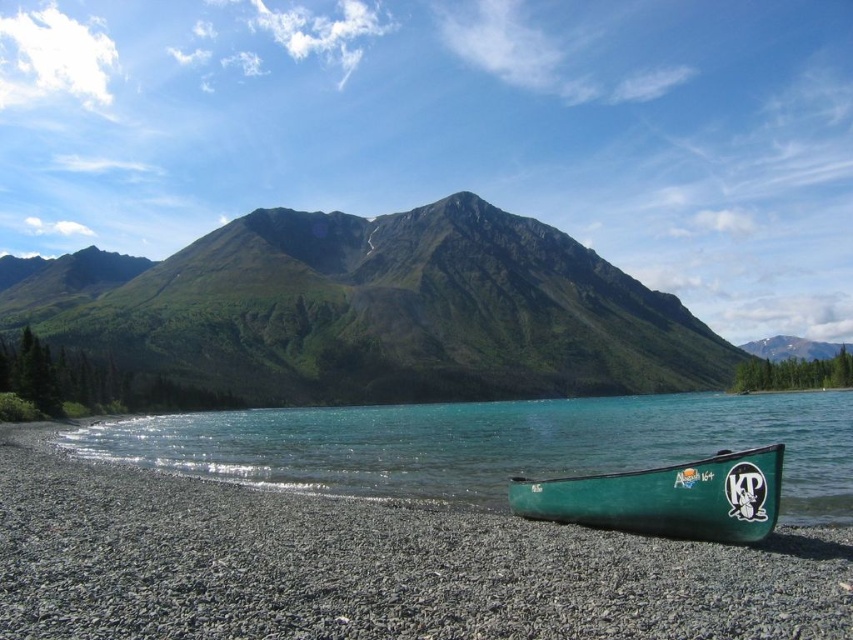
Question: Which of these objects is positioned closest to the green grassy mountain at center?

Choices:
 (A) green matte canoe at lower right
 (B) green plastic canoe at lower center
 (C) green plastic canoe at lower right

Answer: (C)

Question: Can you confirm if green plastic canoe at lower center is positioned to the left of green plastic canoe at lower right?

Choices:
 (A) no
 (B) yes

Answer: (B)

Question: Estimate the real-world distances between objects in this image. Which object is farther from the green matte canoe at lower right?

Choices:
 (A) green plastic canoe at lower center
 (B) green plastic canoe at lower right
 (C) green grassy mountain at center

Answer: (C)

Question: Which of these objects is positioned closest to the green matte canoe at lower right?

Choices:
 (A) green grassy mountain at center
 (B) green plastic canoe at lower right
 (C) green plastic canoe at lower center

Answer: (C)

Question: Where is green grassy mountain at center located in relation to green plastic canoe at lower right in the image?

Choices:
 (A) left
 (B) right

Answer: (A)

Question: From the image, what is the correct spatial relationship of green grassy mountain at center in relation to green matte canoe at lower right?

Choices:
 (A) below
 (B) above

Answer: (B)